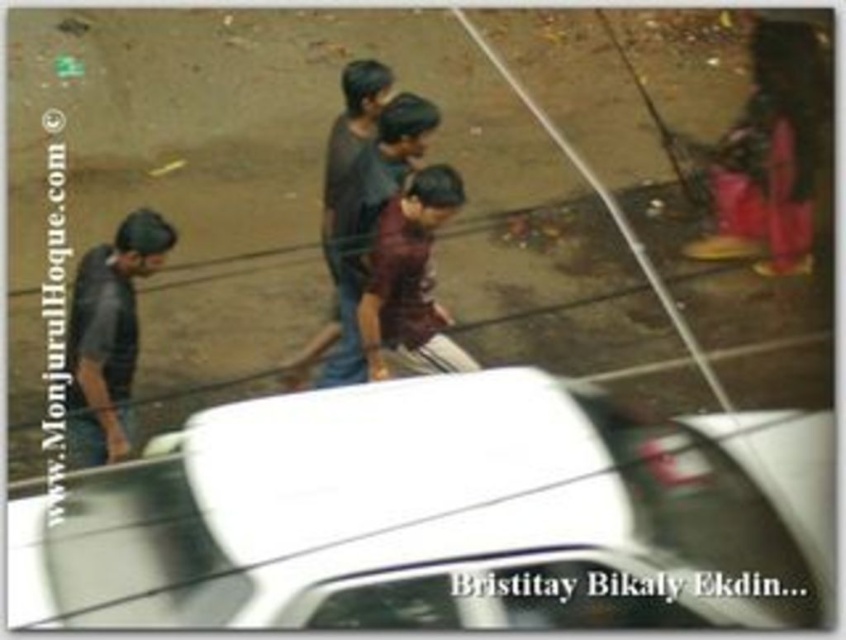
Is white glossy car at lower center shorter than dark blue jeans at left?

Yes, white glossy car at lower center is shorter than dark blue jeans at left.

Does white glossy car at lower center have a larger size compared to dark blue jeans at left?

Indeed, white glossy car at lower center has a larger size compared to dark blue jeans at left.

Between point (22, 538) and point (91, 356), which one is positioned behind?

Positioned behind is point (91, 356).

Identify the location of white glossy car at lower center. (442, 515).

Is point (86, 368) in front of point (404, 316)?

Yes, point (86, 368) is in front of point (404, 316).

Between point (160, 264) and point (407, 221), which one is positioned behind?

The point (407, 221) is behind.

Where is `dark blue jeans at left`? Image resolution: width=846 pixels, height=640 pixels. dark blue jeans at left is located at coordinates (108, 337).

Locate an element on the screen. The width and height of the screenshot is (846, 640). dark blue jeans at left is located at coordinates (108, 337).

Which of these two, white glossy car at lower center or maroon fabric shirt at center, stands shorter?

white glossy car at lower center

Between point (377, 512) and point (429, 230), which one is positioned behind?

The point (429, 230) is behind.

Who is more forward, (547, 564) or (387, 269)?

Point (547, 564) is more forward.

Where is `white glossy car at lower center`? The height and width of the screenshot is (640, 846). white glossy car at lower center is located at coordinates (442, 515).